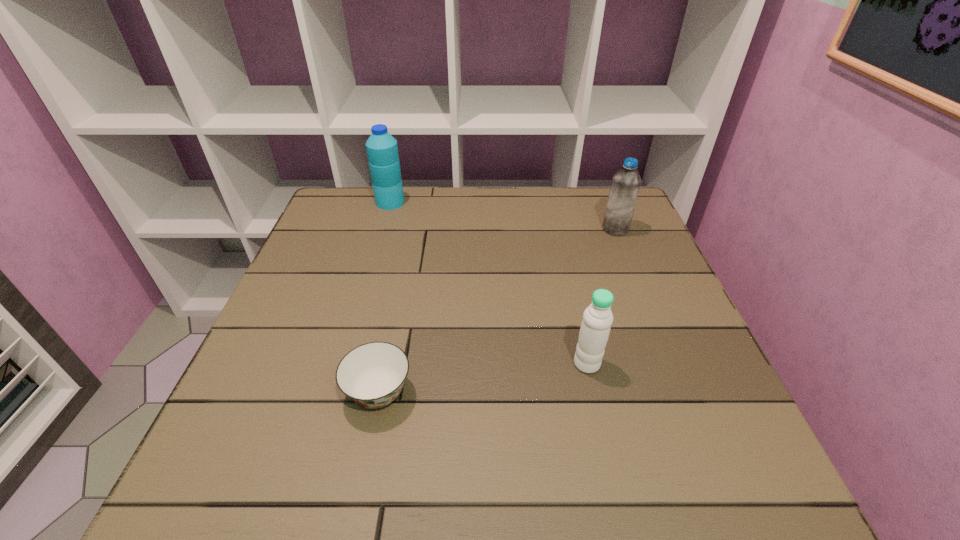
Image resolution: width=960 pixels, height=540 pixels. What are the coordinates of `the leftmost water bottle` in the screenshot? It's located at (382, 150).

Locate an element on the screen. the farthest water bottle is located at coordinates (382, 150).

You are a GUI agent. You are given a task and a screenshot of the screen. Output one action in this format:
    pyautogui.click(x=<x>, y=<y>)
    Task: Click on the second nearest water bottle
    The image size is (960, 540).
    Given the screenshot: What is the action you would take?
    pyautogui.click(x=625, y=185)

You are a GUI agent. You are given a task and a screenshot of the screen. Output one action in this format:
    pyautogui.click(x=<x>, y=<y>)
    Task: Click on the second farthest object
    This screenshot has height=540, width=960.
    Given the screenshot: What is the action you would take?
    pyautogui.click(x=625, y=185)

Find the location of a particular element. The width and height of the screenshot is (960, 540). the nearest water bottle is located at coordinates click(x=597, y=318).

Find the location of a particular element. This screenshot has width=960, height=540. the second water bottle from left to right is located at coordinates (597, 318).

The image size is (960, 540). What are the coordinates of `soup bowl` in the screenshot? It's located at (372, 375).

This screenshot has height=540, width=960. In order to click on free space located on the front of the farthest water bottle in this screenshot , I will do `click(372, 266)`.

This screenshot has width=960, height=540. Identify the location of free space located on the left of the rightmost object. (540, 229).

Identify the location of free space located 0.300m on the back of the nearest water bottle. The image size is (960, 540). point(564,259).